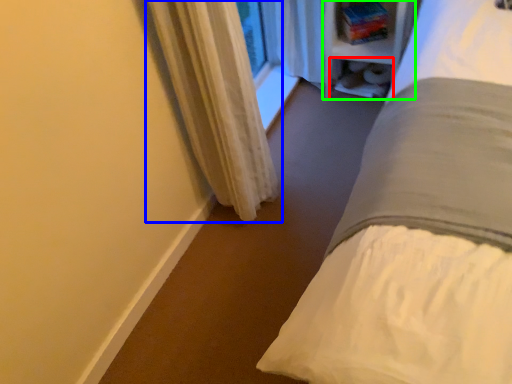
Question: Estimate the real-world distances between objects in this image. Which object is farther from shelf (highlighted by a red box), curtain (highlighted by a blue box) or bookshelf (highlighted by a green box)?

Choices:
 (A) curtain
 (B) bookshelf

Answer: (A)